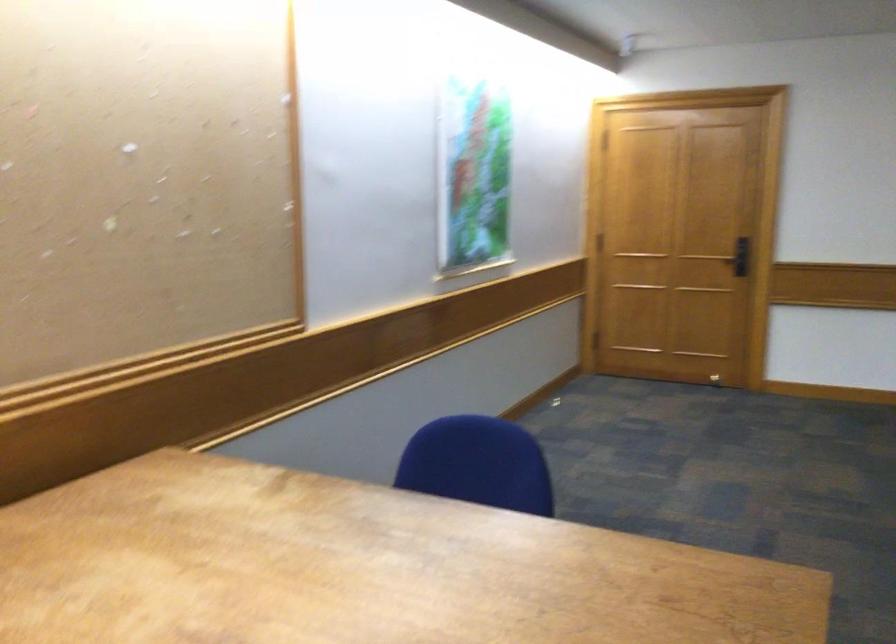
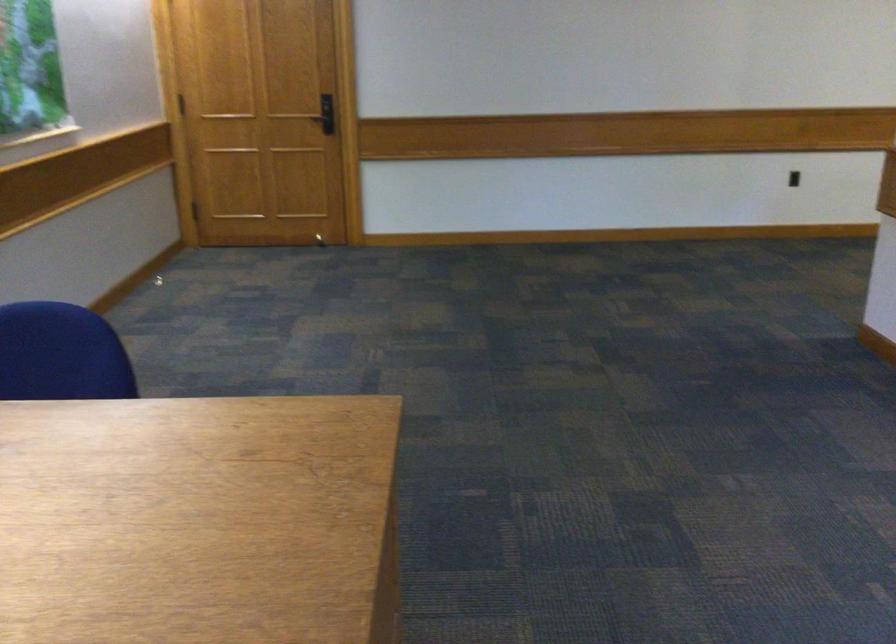
Question: The camera is either moving clockwise (left) or counter-clockwise (right) around the object. The first image is from the beginning of the video and the second image is from the end. Is the camera moving left or right when shooting the video?

Choices:
 (A) Left
 (B) Right

Answer: (A)